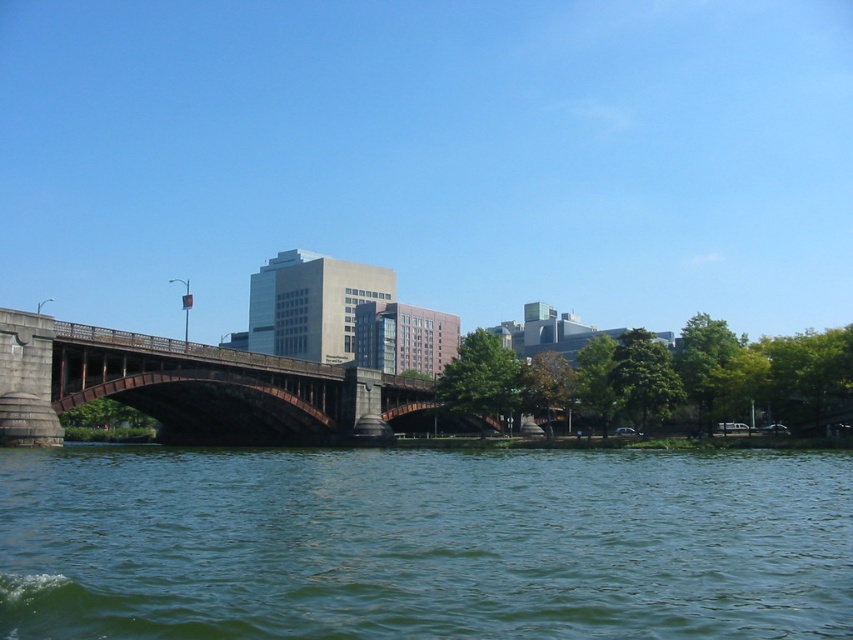
Question: Where is green water at lower center located in relation to brown stone bridge at center in the image?

Choices:
 (A) above
 (B) below

Answer: (B)

Question: Observing the image, what is the correct spatial positioning of green water at lower center in reference to brown stone bridge at center?

Choices:
 (A) right
 (B) left

Answer: (A)

Question: Can you confirm if green water at lower center is positioned to the right of brown stone bridge at center?

Choices:
 (A) yes
 (B) no

Answer: (A)

Question: Among these objects, which one is nearest to the camera?

Choices:
 (A) green water at lower center
 (B) brown stone bridge at center

Answer: (A)

Question: Which point is farther from the camera taking this photo?

Choices:
 (A) (283, 618)
 (B) (283, 429)

Answer: (B)